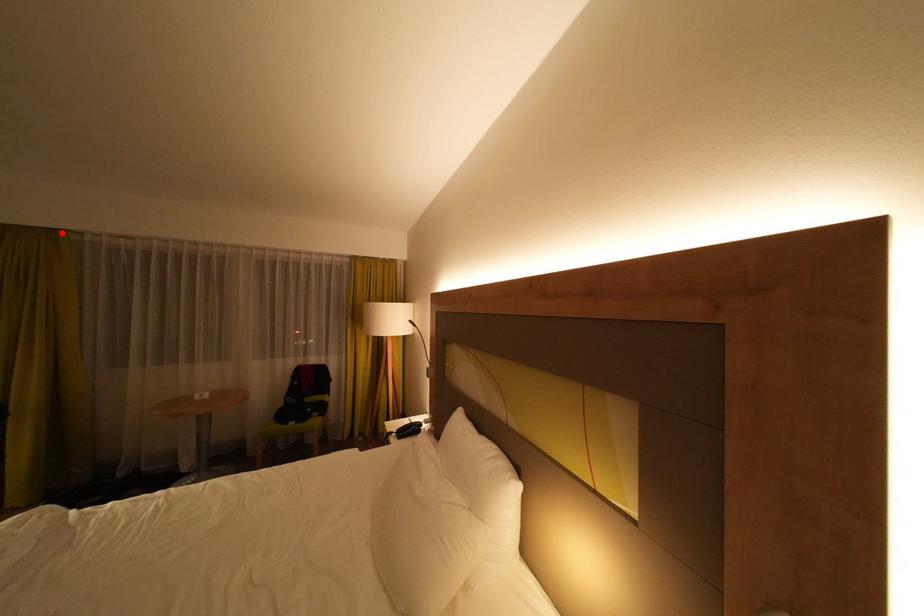
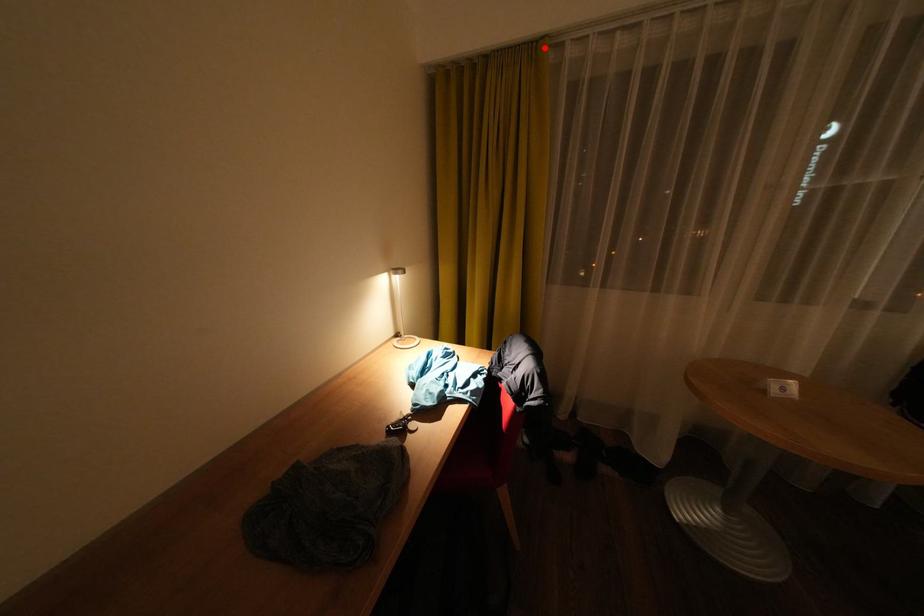
I am providing you with two images of the same scene from different viewpoints. A red point is marked on the first image and another point is marked on the second image. Is the red point in image1 aligned with the point shown in image2?

Yes